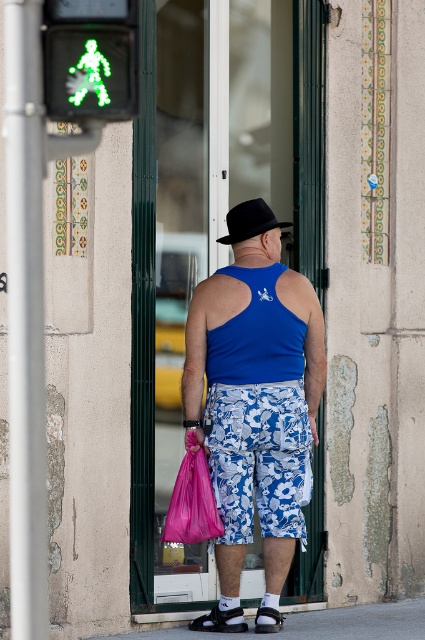
You are a delivery person who needs to place a package at the point marked by coordinates point (258, 458). Based on the scene, where should you deliver the package?

The point (258, 458) is on the blue floral shorts at center, so you should deliver the package to the man standing at the pedestrian crossing signal wearing blue floral shorts at center.

You are a fashion designer observing a man at a pedestrian crossing. He is wearing a blue matte tank top at center and a black felt hat at center. Which clothing item is taller?

The blue matte tank top at center is taller than the black felt hat at center.